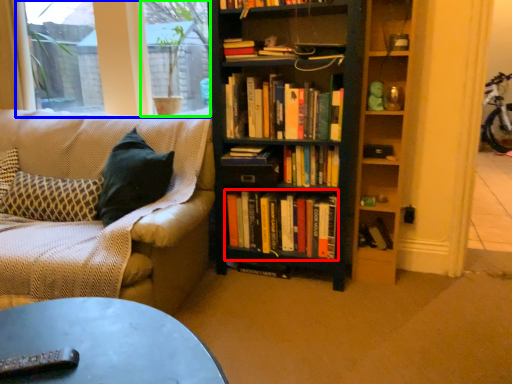
Question: Which object is positioned closest to book (highlighted by a red box)? Select from window screen (highlighted by a blue box) and window screen (highlighted by a green box).

Choices:
 (A) window screen
 (B) window screen

Answer: (B)